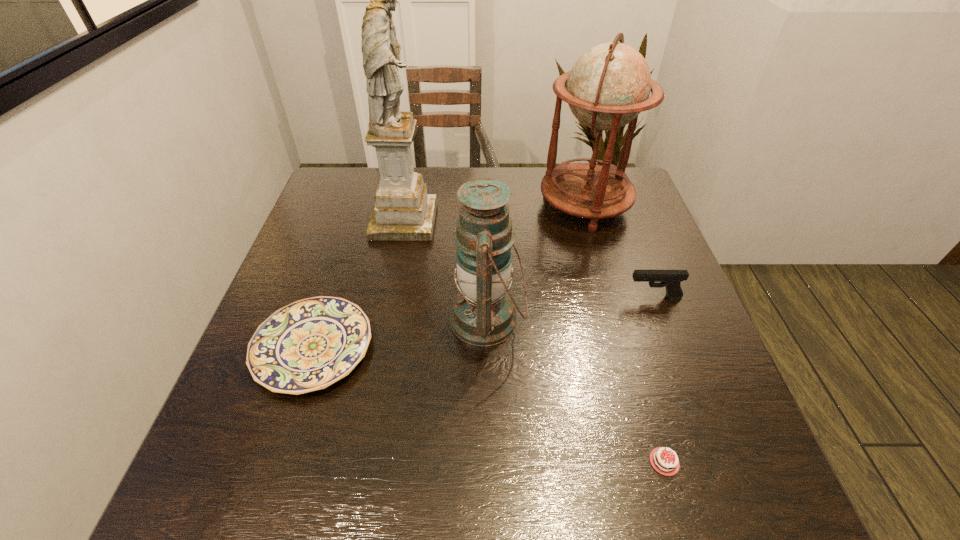
Image resolution: width=960 pixels, height=540 pixels. Identify the location of vacant space that satisfies the following two spatial constraints: 1. on the surface of the globe; 2. on the back side of the nearest object. click(x=657, y=462).

Locate an element on the screen. Image resolution: width=960 pixels, height=540 pixels. vacant space that satisfies the following two spatial constraints: 1. on the front-facing side of the nearest object; 2. on the left side of the sculpture is located at coordinates point(356,462).

The height and width of the screenshot is (540, 960). Find the location of `free space in the image that satisfies the following two spatial constraints: 1. on the front-facing side of the sculpture; 2. on the back side of the chocolate cake`. free space in the image that satisfies the following two spatial constraints: 1. on the front-facing side of the sculpture; 2. on the back side of the chocolate cake is located at coordinates (356, 462).

Image resolution: width=960 pixels, height=540 pixels. Find the location of `free space that satisfies the following two spatial constraints: 1. on the front-facing side of the pistol; 2. on the front side of the chocolate cake`. free space that satisfies the following two spatial constraints: 1. on the front-facing side of the pistol; 2. on the front side of the chocolate cake is located at coordinates (715, 462).

At what (x,y) coordinates should I click in order to perform the action: click on free space that satisfies the following two spatial constraints: 1. on the front-facing side of the tallest object; 2. on the back side of the nearest object. Please return your answer as a coordinate pair (x, y). Looking at the image, I should click on (356, 462).

Where is `free location that satisfies the following two spatial constraints: 1. on the front-facing side of the fourth tallest object; 2. on the front side of the third object from left to right`? free location that satisfies the following two spatial constraints: 1. on the front-facing side of the fourth tallest object; 2. on the front side of the third object from left to right is located at coordinates (662, 319).